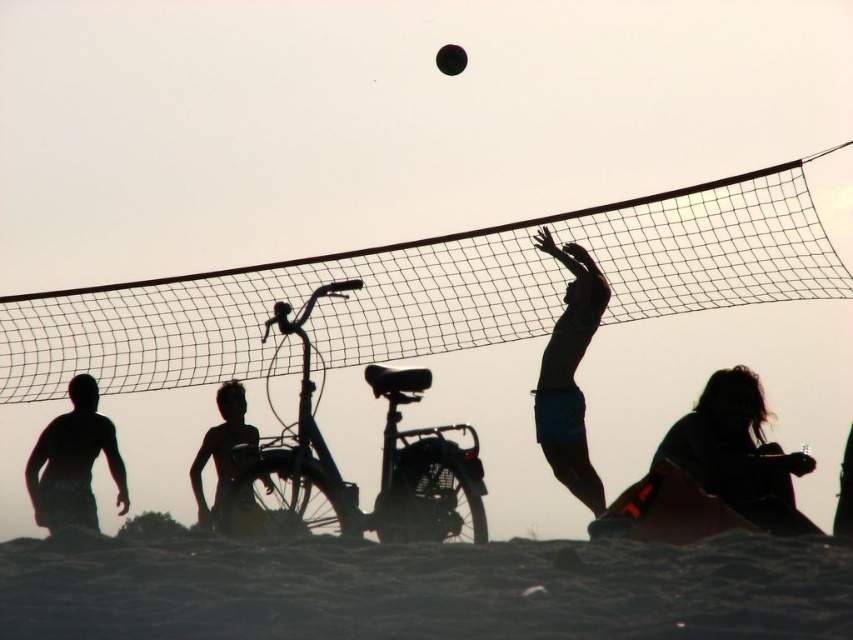
Question: Can you confirm if dark hair at lower right is positioned above silhouette skin at center?

Choices:
 (A) yes
 (B) no

Answer: (A)

Question: Among these objects, which one is farthest from the camera?

Choices:
 (A) black mesh net at upper center
 (B) silhouette shorts at lower left
 (C) dark hair at lower right
 (D) black matte volleyball at upper center

Answer: (B)

Question: Can you confirm if dark hair at lower right is positioned above silhouette shorts at lower left?

Choices:
 (A) no
 (B) yes

Answer: (B)

Question: Based on their relative distances, which object is nearer to the silhouette shorts at lower left?

Choices:
 (A) dark hair at lower right
 (B) black matte volleyball at upper center

Answer: (B)

Question: Does dark hair at lower right appear on the right side of black matte volleyball at upper center?

Choices:
 (A) yes
 (B) no

Answer: (A)

Question: Which of the following is the closest to the observer?

Choices:
 (A) (71, 394)
 (B) (456, 49)

Answer: (B)